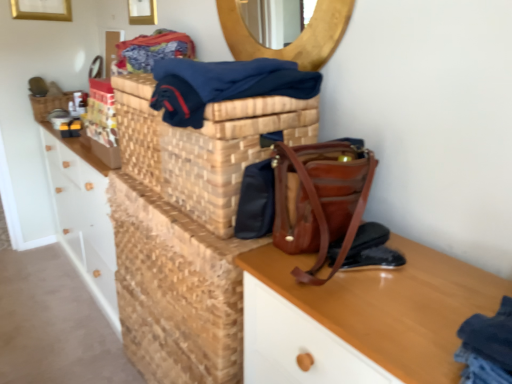
Question: Can you confirm if woven brown basket at center is positioned to the left of leather at center, acting as the 2th shoe starting from the bottom?

Choices:
 (A) yes
 (B) no

Answer: (A)

Question: From a real-world perspective, is woven brown basket at center physically above leather at center, acting as the 2th shoe starting from the bottom?

Choices:
 (A) no
 (B) yes

Answer: (B)

Question: Is woven brown basket at center next to leather at center, acting as the 2th shoe starting from the bottom, and touching it?

Choices:
 (A) no
 (B) yes

Answer: (A)

Question: Is woven brown basket at center shorter than leather at center, acting as the 2th shoe starting from the bottom?

Choices:
 (A) no
 (B) yes

Answer: (A)

Question: Considering the relative positions of woven brown basket at center and leather at center, the 1th shoe in the top-to-bottom sequence, in the image provided, is woven brown basket at center to the right of leather at center, the 1th shoe in the top-to-bottom sequence, from the viewer's perspective?

Choices:
 (A) yes
 (B) no

Answer: (B)

Question: Considering the positions of leather at center, the 1th shoe in the top-to-bottom sequence, and gold metallic picture frame at upper left, which ranks as the second picture frame in front-to-back order, in the image, is leather at center, the 1th shoe in the top-to-bottom sequence, bigger or smaller than gold metallic picture frame at upper left, which ranks as the second picture frame in front-to-back order,?

Choices:
 (A) big
 (B) small

Answer: (B)

Question: From the image's perspective, is leather at center, the 1th shoe in the top-to-bottom sequence, above or below gold metallic picture frame at upper left, the second picture frame viewed from the right?

Choices:
 (A) below
 (B) above

Answer: (A)

Question: Is leather at center, the 1th shoe in the top-to-bottom sequence, wider or thinner than gold metallic picture frame at upper left, which appears as the 1th picture frame when viewed from the back?

Choices:
 (A) thin
 (B) wide

Answer: (B)

Question: In the image, is leather at center, acting as the 2th shoe starting from the bottom, on the left side or the right side of gold metallic picture frame at upper left, which appears as the 1th picture frame when viewed from the left?

Choices:
 (A) right
 (B) left

Answer: (A)

Question: From the image's perspective, is woven brown basket at center above or below leather at center, the 1th shoe in the top-to-bottom sequence?

Choices:
 (A) below
 (B) above

Answer: (B)

Question: Is woven brown basket at center to the left or to the right of leather at center, acting as the 2th shoe starting from the bottom, in the image?

Choices:
 (A) left
 (B) right

Answer: (A)

Question: Would you say woven brown basket at center is inside or outside leather at center, acting as the 2th shoe starting from the bottom?

Choices:
 (A) outside
 (B) inside

Answer: (A)

Question: Does point (209, 180) appear closer or farther from the camera than point (338, 240)?

Choices:
 (A) farther
 (B) closer

Answer: (A)

Question: Considering their positions, is wooden woven basket at upper left located in front of or behind wooden picture frame at upper center, which ranks as the 1th picture frame in right-to-left order?

Choices:
 (A) behind
 (B) front

Answer: (A)

Question: Visually, is wooden woven basket at upper left positioned to the left or to the right of wooden picture frame at upper center, the 2th picture frame positioned from the back?

Choices:
 (A) right
 (B) left

Answer: (B)